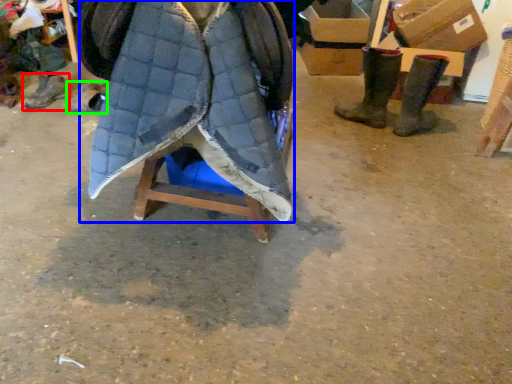
Question: Which is farther away from footwear (highlighted by a red box)? cloak (highlighted by a blue box) or footwear (highlighted by a green box)?

Choices:
 (A) cloak
 (B) footwear

Answer: (A)